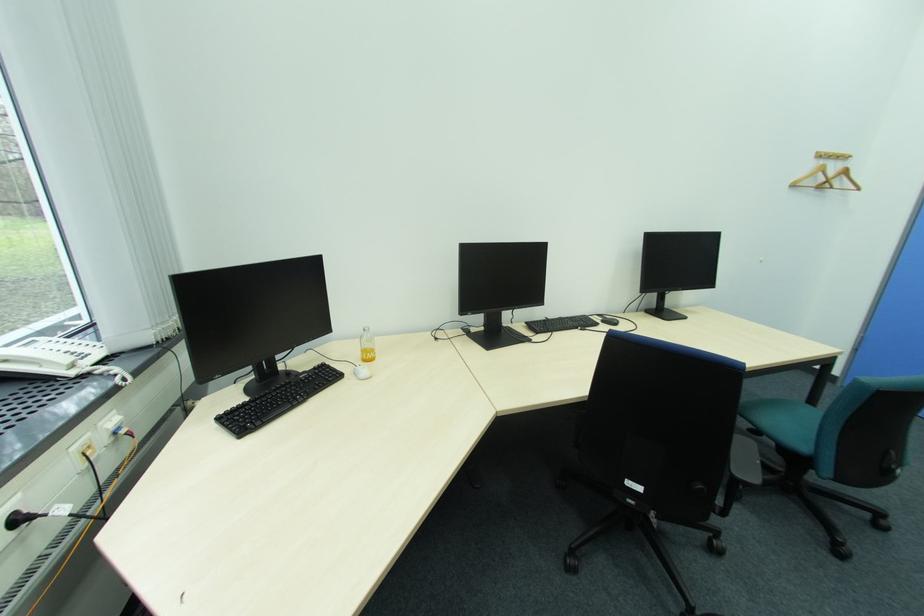
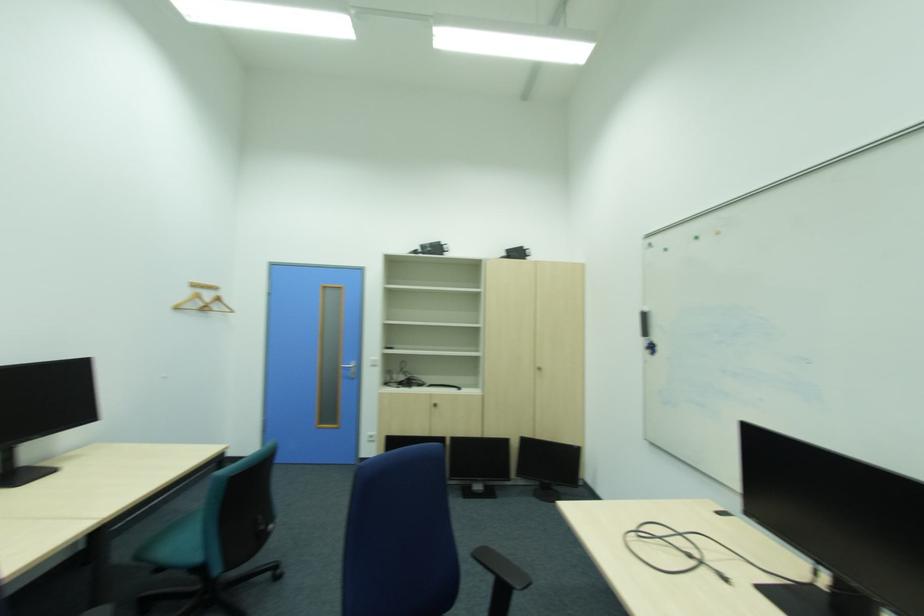
In the second image, find the point that corresponds to [819,164] in the first image.

(199, 292)